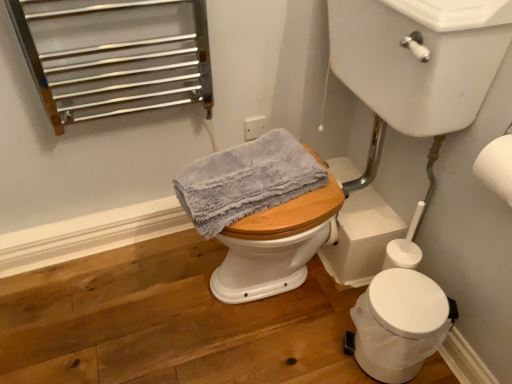
Where is `white matte toilet paper at upper right`? Image resolution: width=512 pixels, height=384 pixels. white matte toilet paper at upper right is located at coordinates (496, 166).

The height and width of the screenshot is (384, 512). What do you see at coordinates (496, 166) in the screenshot?
I see `white matte toilet paper at upper right` at bounding box center [496, 166].

At what (x,y) coordinates should I click in order to perform the action: click on gray textured towel at center. Please return your answer as a coordinate pair (x, y). The image size is (512, 384). Looking at the image, I should click on (246, 180).

Is white plastic trash can at lower right oriented towards white matte toilet paper at upper right?

No, white plastic trash can at lower right is not turned towards white matte toilet paper at upper right.

Is white plastic trash can at lower right spatially inside white matte toilet paper at upper right, or outside of it?

white plastic trash can at lower right is outside white matte toilet paper at upper right.

Considering the sizes of objects white plastic trash can at lower right and white matte toilet paper at upper right in the image provided, who is shorter, white plastic trash can at lower right or white matte toilet paper at upper right?

Standing shorter between the two is white matte toilet paper at upper right.

How far apart are white plastic trash can at lower right and white matte toilet paper at upper right?

18.05 inches.

From the picture: Which is more distant, (x=434, y=331) or (x=241, y=149)?

The point (x=241, y=149) is farther.

Between white plastic trash can at lower right and gray textured towel at center, which one has larger width?

With larger width is gray textured towel at center.

Considering the relative positions of white plastic trash can at lower right and gray textured towel at center in the image provided, is white plastic trash can at lower right behind gray textured towel at center?

Yes, white plastic trash can at lower right is behind gray textured towel at center.

Is white plastic trash can at lower right spatially inside gray textured towel at center, or outside of it?

white plastic trash can at lower right cannot be found inside gray textured towel at center.

From the picture: Is gray textured towel at center at the left side of white plastic trash can at lower right?

Correct, you'll find gray textured towel at center to the left of white plastic trash can at lower right.

Is gray textured towel at center turned away from white plastic trash can at lower right?

That's not correct — gray textured towel at center is not looking away from white plastic trash can at lower right.

I want to click on bath towel above the white plastic trash can at lower right (from a real-world perspective), so click(246, 180).

From a real-world perspective, is gray textured towel at center on white matte toilet paper at upper right?

Incorrect, from a real-world perspective, gray textured towel at center is lower than white matte toilet paper at upper right.

The height and width of the screenshot is (384, 512). What are the coordinates of `bath towel on the left of the white matte toilet paper at upper right` in the screenshot? It's located at (246, 180).

Looking at their sizes, would you say gray textured towel at center is wider or thinner than white matte toilet paper at upper right?

In the image, gray textured towel at center appears to be wider than white matte toilet paper at upper right.

Does gray textured towel at center appear on the left side of white matte toilet paper at upper right?

Correct, you'll find gray textured towel at center to the left of white matte toilet paper at upper right.

Which of these two, white plastic trash can at lower right or white glossy sink at upper right, is smaller?

white plastic trash can at lower right.

Based on the photo, between white plastic trash can at lower right and white glossy sink at upper right, which one has larger width?

white glossy sink at upper right.

From a real-world perspective, which object stands above the other?

white glossy sink at upper right is physically above.

Is white glossy sink at upper right surrounded by white plastic trash can at lower right?

Definitely not — white glossy sink at upper right is not inside white plastic trash can at lower right.

Measure the distance from white glossy sink at upper right to white matte toilet paper at upper right.

white glossy sink at upper right and white matte toilet paper at upper right are 9.75 inches apart from each other.

Is white glossy sink at upper right taller or shorter than white matte toilet paper at upper right?

white glossy sink at upper right is taller than white matte toilet paper at upper right.

Is the surface of white glossy sink at upper right in direct contact with white matte toilet paper at upper right?

white glossy sink at upper right is not next to white matte toilet paper at upper right, and they're not touching.

Is white glossy sink at upper right completely or partially outside of white matte toilet paper at upper right?

Yes, white glossy sink at upper right is not within white matte toilet paper at upper right.

This screenshot has width=512, height=384. Identify the location of toilet located below the white glossy sink at upper right (from the image's perspective). (399, 324).

Is white glossy sink at upper right surrounding white plastic trash can at lower right?

No, white plastic trash can at lower right is not surrounded by white glossy sink at upper right.

Is white glossy sink at upper right oriented towards white plastic trash can at lower right?

No, white glossy sink at upper right does not turn towards white plastic trash can at lower right.

Where is `toilet paper in front of the white plastic trash can at lower right`? The image size is (512, 384). toilet paper in front of the white plastic trash can at lower right is located at coordinates (496, 166).

The height and width of the screenshot is (384, 512). What are the coordinates of `toilet behind the gray textured towel at center` in the screenshot? It's located at (399, 324).

Estimate the real-world distances between objects in this image. Which object is closer to white matte toilet paper at upper right, white glossy sink at upper right or gray textured towel at center?

white glossy sink at upper right is closer to white matte toilet paper at upper right.

Based on their spatial positions, is gray textured towel at center or white matte toilet paper at upper right closer to white plastic trash can at lower right?

gray textured towel at center.

Based on their spatial positions, is white matte toilet paper at upper right or white plastic trash can at lower right further from white glossy sink at upper right?

white plastic trash can at lower right.

Based on their spatial positions, is white plastic trash can at lower right or gray textured towel at center closer to white matte toilet paper at upper right?

The object closer to white matte toilet paper at upper right is white plastic trash can at lower right.

Based on their spatial positions, is gray textured towel at center or white plastic trash can at lower right closer to white matte toilet paper at upper right?

white plastic trash can at lower right.

From the image, which object appears to be nearer to gray textured towel at center, white glossy sink at upper right or white matte toilet paper at upper right?

white glossy sink at upper right is closer to gray textured towel at center.

Looking at the image, which one is located further to white matte toilet paper at upper right, white plastic trash can at lower right or white glossy sink at upper right?

white plastic trash can at lower right.

When comparing their distances from white plastic trash can at lower right, does white glossy sink at upper right or gray textured towel at center seem closer?

Among the two, gray textured towel at center is located nearer to white plastic trash can at lower right.

Where is `sink between gray textured towel at center and white matte toilet paper at upper right in the horizontal direction`? sink between gray textured towel at center and white matte toilet paper at upper right in the horizontal direction is located at coordinates (419, 58).

I want to click on toilet situated between gray textured towel at center and white matte toilet paper at upper right from left to right, so click(399, 324).

Where is `toilet paper between white glossy sink at upper right and white plastic trash can at lower right from top to bottom`? The width and height of the screenshot is (512, 384). toilet paper between white glossy sink at upper right and white plastic trash can at lower right from top to bottom is located at coordinates (496, 166).

Locate an element on the screen. The width and height of the screenshot is (512, 384). bath towel between white glossy sink at upper right and white plastic trash can at lower right from top to bottom is located at coordinates (246, 180).